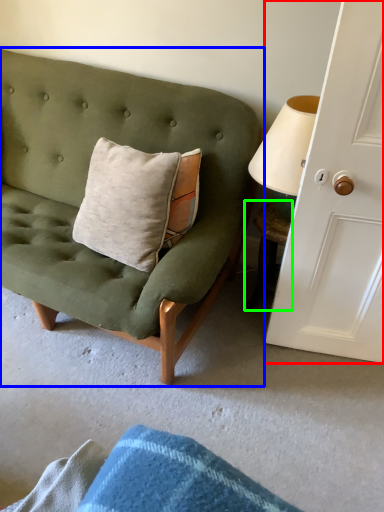
Question: Estimate the real-world distances between objects in this image. Which object is farther from door (highlighted by a red box), studio couch (highlighted by a blue box) or table (highlighted by a green box)?

Choices:
 (A) studio couch
 (B) table

Answer: (A)